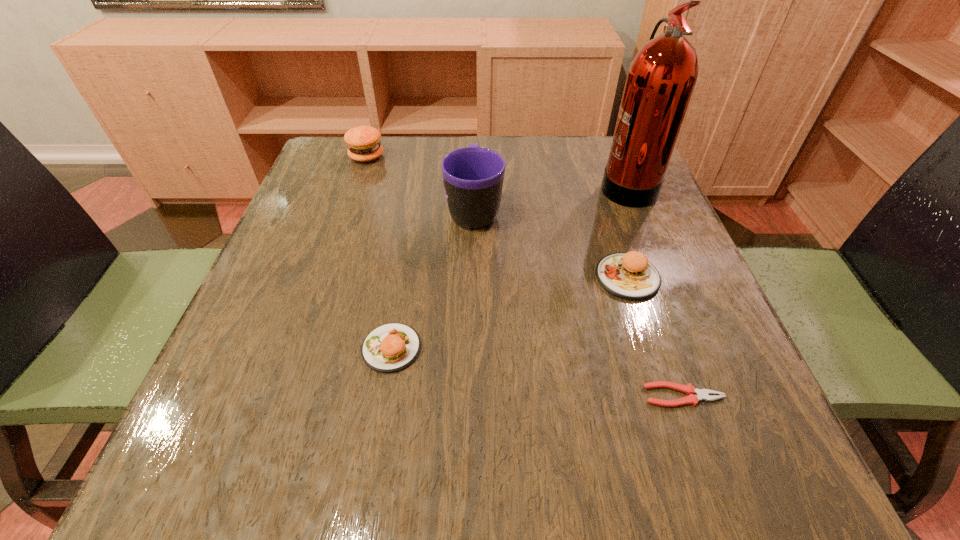
Image resolution: width=960 pixels, height=540 pixels. Identify the location of vacant space at the far edge. (556, 140).

You are a GUI agent. You are given a task and a screenshot of the screen. Output one action in this format:
    pyautogui.click(x=<x>, y=<y>)
    Task: Click on the vacant area at the near edge
    
    Given the screenshot: What is the action you would take?
    pyautogui.click(x=559, y=450)

In the image, there is a desktop. Where is `vacant space at the left edge`? vacant space at the left edge is located at coordinates (281, 253).

Where is `vacant position at the right edge of the desktop`? The width and height of the screenshot is (960, 540). vacant position at the right edge of the desktop is located at coordinates (665, 213).

The width and height of the screenshot is (960, 540). What are the coordinates of `free space at the far left corner of the desktop` in the screenshot? It's located at (353, 186).

Find the location of a particular element. vacant space that is in between the tallest object and the mug is located at coordinates (550, 197).

The width and height of the screenshot is (960, 540). Identify the location of free spot between the second patty from right to left and the third object from left to right. (433, 279).

The height and width of the screenshot is (540, 960). I want to click on vacant space that is in between the mug and the fourth shortest object, so click(420, 183).

In order to click on empty location between the leftmost object and the third object from left to right in this screenshot , I will do `click(420, 183)`.

Identify the location of free spot between the fourth tallest object and the second object from left to right. (510, 313).